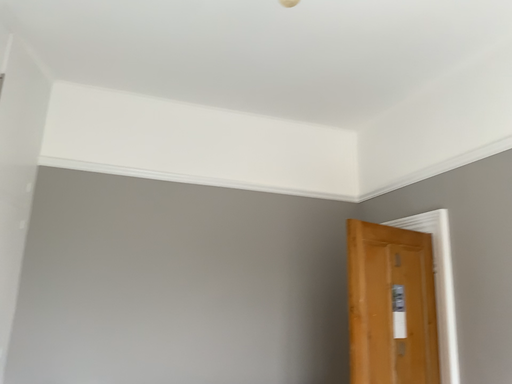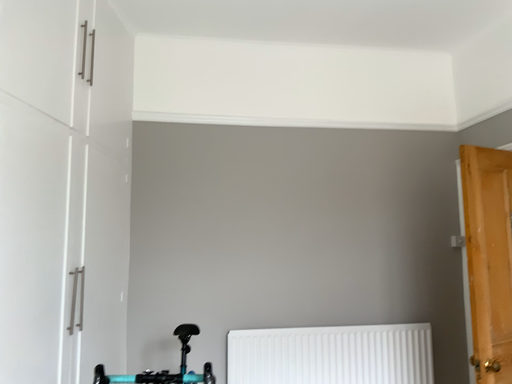
Question: How did the camera likely rotate when shooting the video?

Choices:
 (A) rotated upward
 (B) rotated downward

Answer: (B)